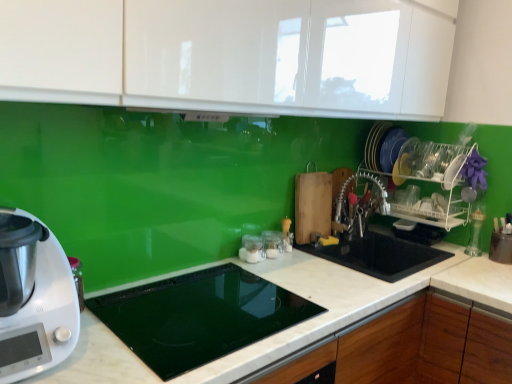
Locate an element on the screen. vacant space in front of clear glass jars at center, which is the third appliance from front to back is located at coordinates (274, 271).